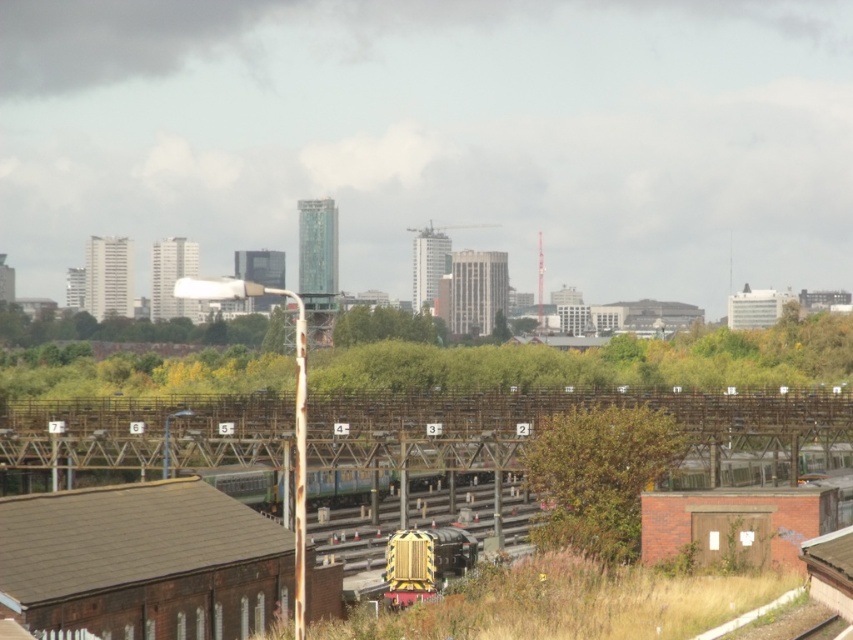
Who is shorter, brown textured bush at center or yellow matte train at center?

yellow matte train at center is shorter.

Can you confirm if brown textured bush at center is positioned to the left of yellow matte train at center?

Incorrect, brown textured bush at center is not on the left side of yellow matte train at center.

Where is `brown textured bush at center`? The height and width of the screenshot is (640, 853). brown textured bush at center is located at coordinates (598, 476).